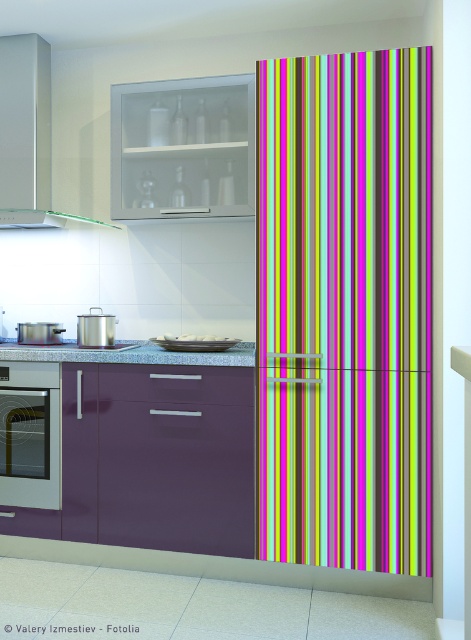
Question: Which of the following is the farthest from the observer?

Choices:
 (A) satin silver stove at lower left
 (B) multicolored striped curtain at center
 (C) granite countertop at center
 (D) matte white exhaust hood at upper left

Answer: (D)

Question: Can you confirm if matte white exhaust hood at upper left is wider than matte silver tray at center?

Choices:
 (A) yes
 (B) no

Answer: (A)

Question: Which of the following is the farthest from the observer?

Choices:
 (A) matte silver oven at left
 (B) multicolored striped curtain at center

Answer: (A)

Question: Is matte silver oven at left above satin silver stove at lower left?

Choices:
 (A) yes
 (B) no

Answer: (B)

Question: Among these objects, which one is nearest to the camera?

Choices:
 (A) granite countertop at center
 (B) satin silver toaster at lower left

Answer: (A)

Question: Observing the image, what is the correct spatial positioning of matte silver oven at left in reference to satin silver stove at lower left?

Choices:
 (A) above
 (B) below

Answer: (B)